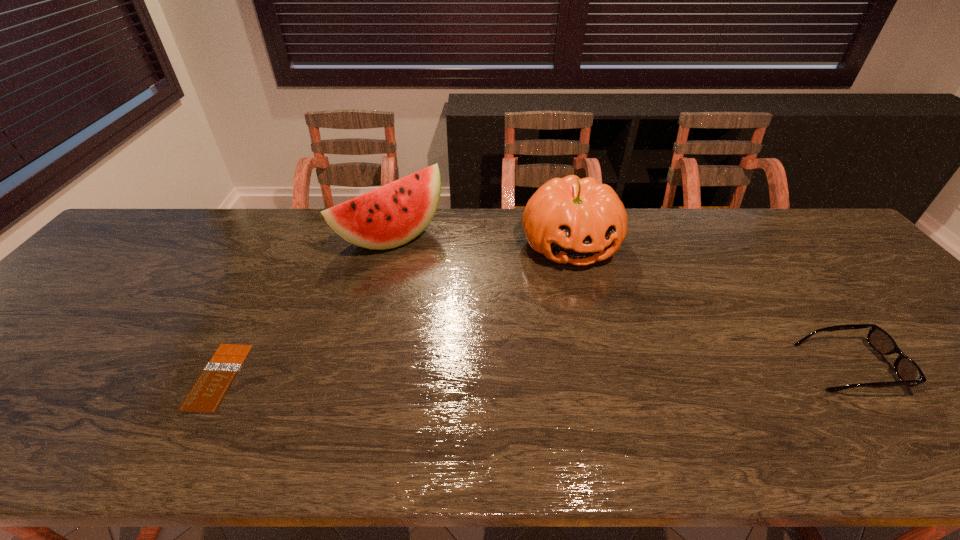
Where is `free space that satisfies the following two spatial constraints: 1. on the back side of the shortest object; 2. on the right side of the watermelon`? The height and width of the screenshot is (540, 960). free space that satisfies the following two spatial constraints: 1. on the back side of the shortest object; 2. on the right side of the watermelon is located at coordinates (292, 237).

Identify the location of free space that satisfies the following two spatial constraints: 1. on the back side of the third object from right to left; 2. on the right side of the chocolate bar. Image resolution: width=960 pixels, height=540 pixels. (292, 237).